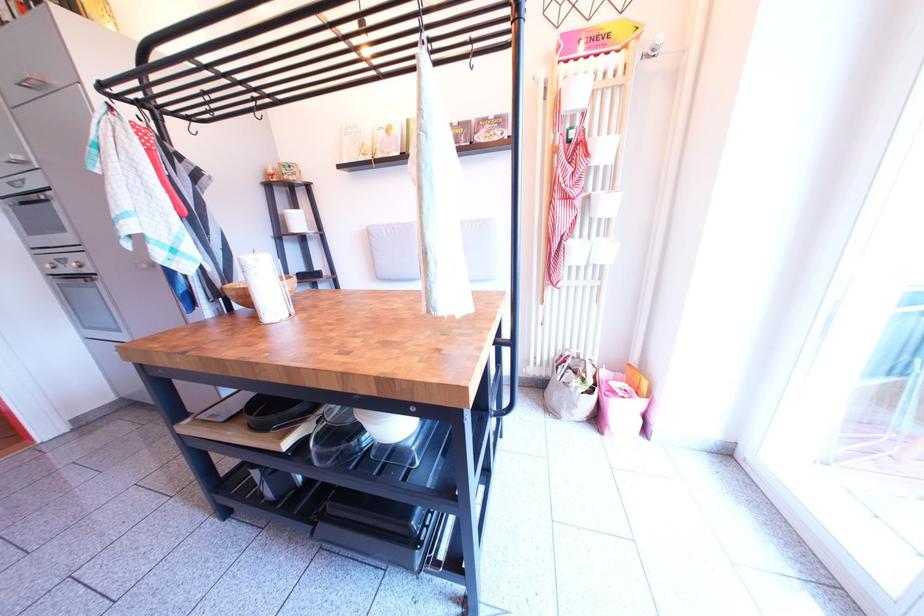
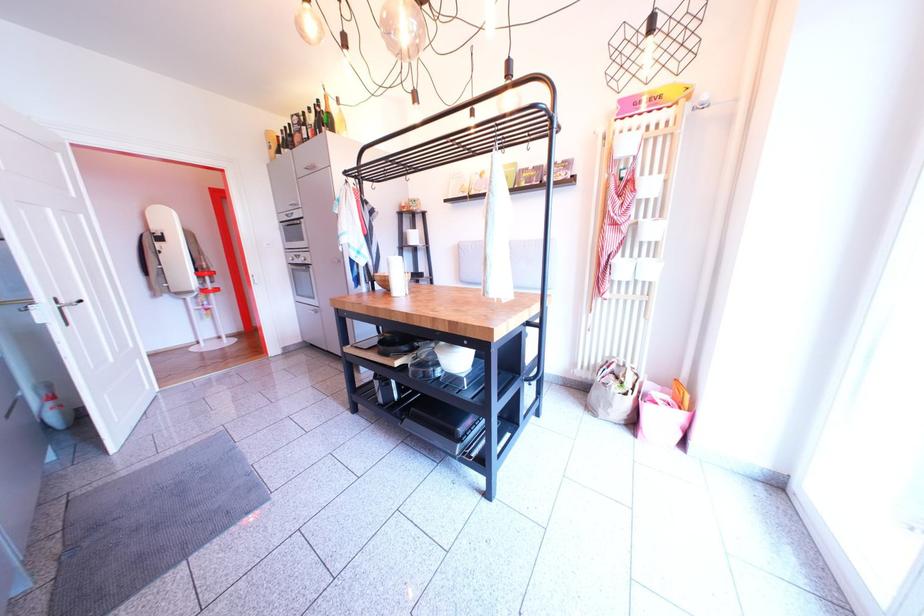
The images are taken continuously from a first-person perspective. In which direction are you moving?

The cameraman walked toward right, backward.